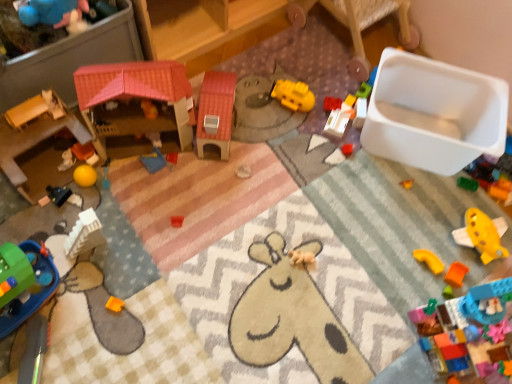
This screenshot has width=512, height=384. Find the location of `free space between yellow plastic block at upper center, which appears as the 11th toy when viewed from the left, and yellow matte plastic toy at center, which is the 8th toy from right to left`. free space between yellow plastic block at upper center, which appears as the 11th toy when viewed from the left, and yellow matte plastic toy at center, which is the 8th toy from right to left is located at coordinates (328, 108).